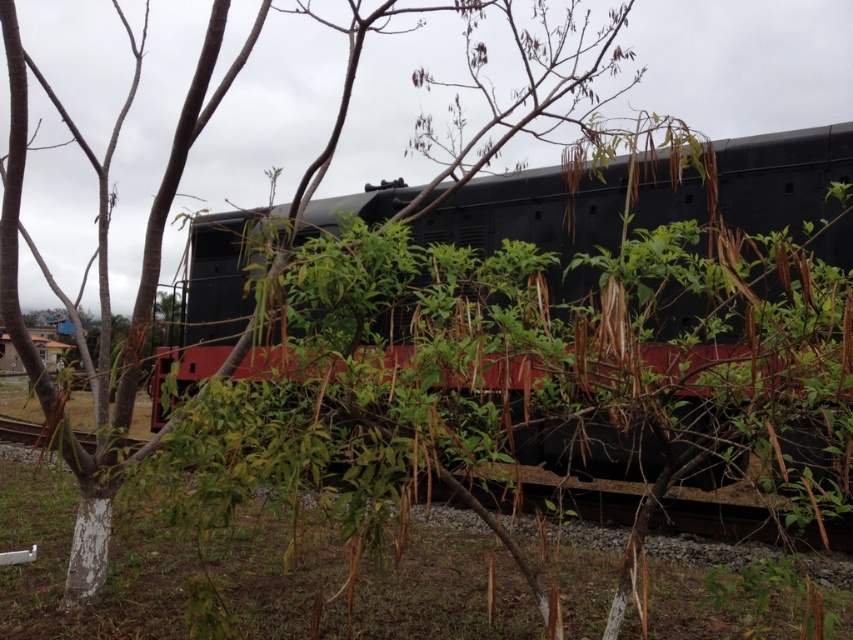
Does matte black train at center appear on the right side of black metal train track at center?

Yes, matte black train at center is to the right of black metal train track at center.

From the picture: Is matte black train at center further to the viewer compared to black metal train track at center?

Yes, matte black train at center is behind black metal train track at center.

Between point (587, 184) and point (694, 529), which one is positioned in front?

Point (694, 529) is more forward.

Where is `matte black train at center`? matte black train at center is located at coordinates (535, 218).